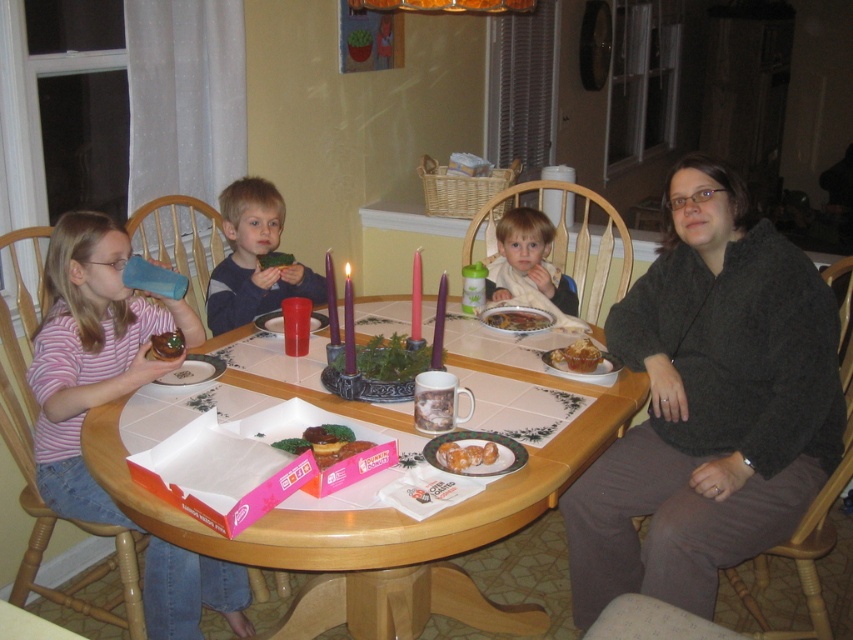
Between wooden table at center and matte black sweater at upper right, which one has less height?

wooden table at center is shorter.

Looking at this image, is wooden table at center taller than matte black sweater at upper right?

In fact, wooden table at center may be shorter than matte black sweater at upper right.

Between point (421, 541) and point (305, 385), which one is positioned behind?

Positioned behind is point (305, 385).

Where is `wooden table at center`? wooden table at center is located at coordinates (387, 529).

Is point (776, 365) behind point (167, 342)?

No, it is not.

Measure the distance between dark gray sweater at right and green matte donut at center.

dark gray sweater at right and green matte donut at center are 1.15 meters apart.

Which is in front, point (770, 298) or point (180, 348)?

Positioned in front is point (770, 298).

Image resolution: width=853 pixels, height=640 pixels. Find the location of `dark gray sweater at right`. dark gray sweater at right is located at coordinates (709, 404).

Is point (294, 392) farther from camera compared to point (286, 264)?

No, it is not.

Does wooden table at center have a greater height compared to green leafy vegetable at center?

Yes.

This screenshot has height=640, width=853. What do you see at coordinates (387, 529) in the screenshot?
I see `wooden table at center` at bounding box center [387, 529].

Identify the location of wooden table at center. The width and height of the screenshot is (853, 640). (387, 529).